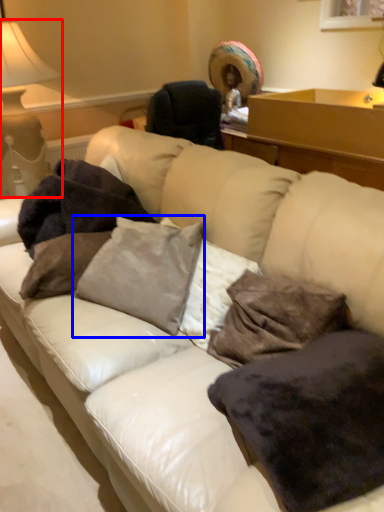
Question: Among these objects, which one is nearest to the camera, table lamp (highlighted by a red box) or pillow (highlighted by a blue box)?

Choices:
 (A) table lamp
 (B) pillow

Answer: (B)